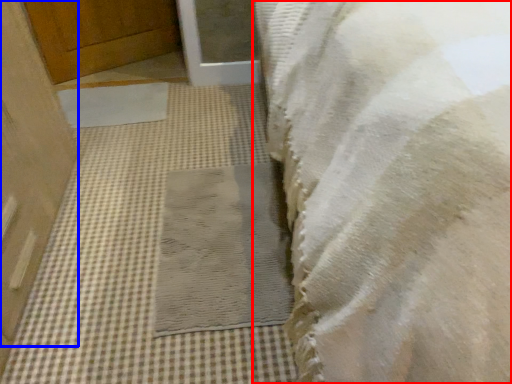
Question: Among these objects, which one is nearest to the camera, towel (highlighted by a red box) or door (highlighted by a blue box)?

Choices:
 (A) towel
 (B) door

Answer: (A)